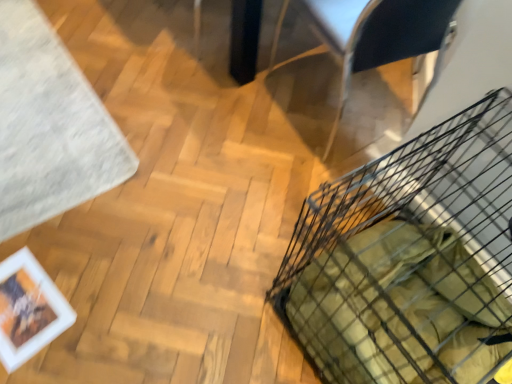
In order to click on vacant area that lies between black wire basket at lower right and white soft rug at upper left in this screenshot , I will do `click(172, 192)`.